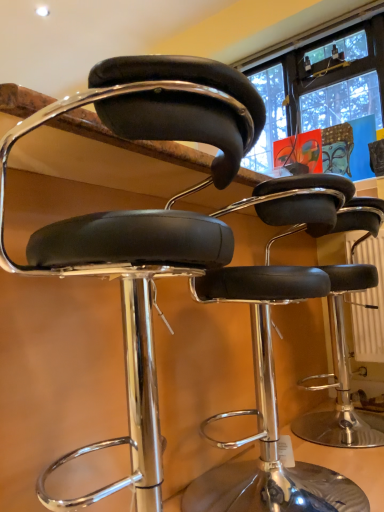
Question: Is black leather stool at center, the 1th chair when ordered from back to front, in front of or behind black leather stool at center, the first chair in the front-to-back sequence, in the image?

Choices:
 (A) front
 (B) behind

Answer: (B)

Question: In terms of height, does black leather stool at center, the 1th chair when ordered from back to front, look taller or shorter compared to black leather stool at center, positioned as the second chair in back-to-front order?

Choices:
 (A) tall
 (B) short

Answer: (B)

Question: From a real-world perspective, is black leather stool at center, the 1th chair when ordered from back to front, physically located above or below black leather stool at center, positioned as the second chair in back-to-front order?

Choices:
 (A) below
 (B) above

Answer: (A)

Question: Choose the correct answer: Is black leather stool at center, positioned as the second chair in back-to-front order, inside black leather stool at center, the 1th chair when ordered from back to front, or outside it?

Choices:
 (A) inside
 (B) outside

Answer: (B)

Question: Considering the positions of black leather stool at center, positioned as the second chair in back-to-front order, and black leather stool at center, placed as the second chair when sorted from front to back, in the image, is black leather stool at center, positioned as the second chair in back-to-front order, taller or shorter than black leather stool at center, placed as the second chair when sorted from front to back,?

Choices:
 (A) short
 (B) tall

Answer: (B)

Question: Is black leather stool at center, positioned as the second chair in back-to-front order, bigger or smaller than black leather stool at center, the 1th chair when ordered from back to front?

Choices:
 (A) small
 (B) big

Answer: (B)

Question: From the image's perspective, is black leather stool at center, positioned as the second chair in back-to-front order, positioned above or below black leather stool at center, placed as the second chair when sorted from front to back?

Choices:
 (A) below
 (B) above

Answer: (B)